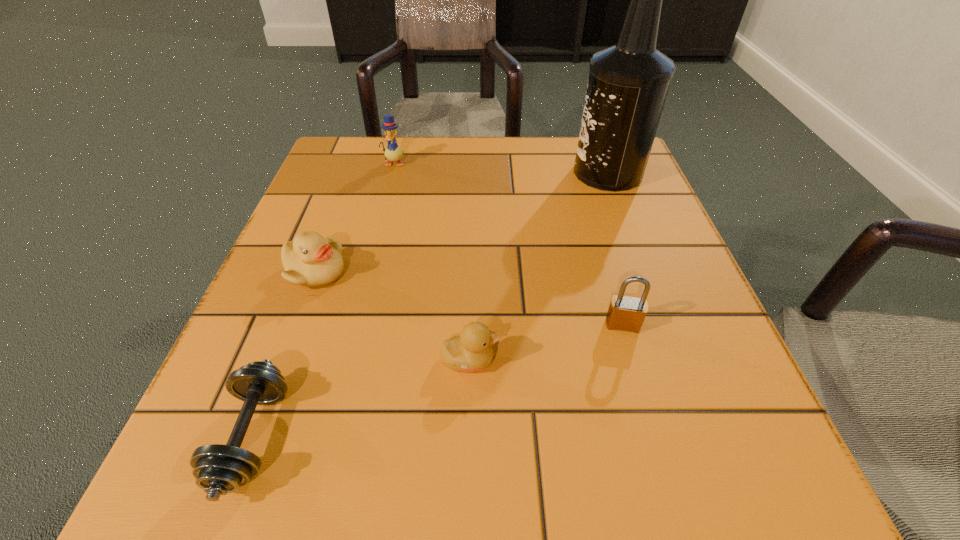
Where is `free point at the far left corner`? The height and width of the screenshot is (540, 960). free point at the far left corner is located at coordinates (348, 145).

Find the location of a particular element. Image resolution: width=960 pixels, height=540 pixels. vacant space at the near left corner of the desktop is located at coordinates (271, 464).

Find the location of `vacant space at the near right corner of the desktop`. vacant space at the near right corner of the desktop is located at coordinates (759, 514).

Locate an element on the screen. The image size is (960, 540). free space between the farthest duckling and the tallest object is located at coordinates click(x=501, y=168).

You are a GUI agent. You are given a task and a screenshot of the screen. Output one action in this format:
    pyautogui.click(x=<x>, y=<y>)
    Task: Click on the free space between the dumbbell and the liquor
    This screenshot has height=540, width=960.
    Given the screenshot: What is the action you would take?
    pyautogui.click(x=430, y=305)

At what (x,y) coordinates should I click in order to perform the action: click on free space between the dumbbell and the padlock. Please return your answer as a coordinate pair (x, y). The height and width of the screenshot is (540, 960). Looking at the image, I should click on (438, 381).

Locate an element on the screen. This screenshot has height=540, width=960. free space between the farthest duckling and the shortest duckling is located at coordinates (432, 261).

The image size is (960, 540). Identify the location of free space between the fourth nearest object and the third nearest object. (468, 298).

You are a GUI agent. You are given a task and a screenshot of the screen. Output one action in this format:
    pyautogui.click(x=<x>, y=<y>)
    Task: Click on the free space that is in between the fourth farthest object and the tallest duckling
    This screenshot has height=540, width=960.
    Given the screenshot: What is the action you would take?
    pyautogui.click(x=508, y=244)

Identify the location of free space between the liquor and the third farthest object. (461, 222).